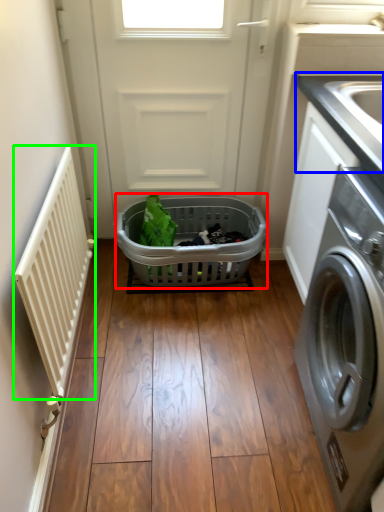
Question: Which object is positioned closest to basket (highlighted by a red box)? Select from counter top (highlighted by a blue box) and balustrade (highlighted by a green box).

Choices:
 (A) counter top
 (B) balustrade

Answer: (B)